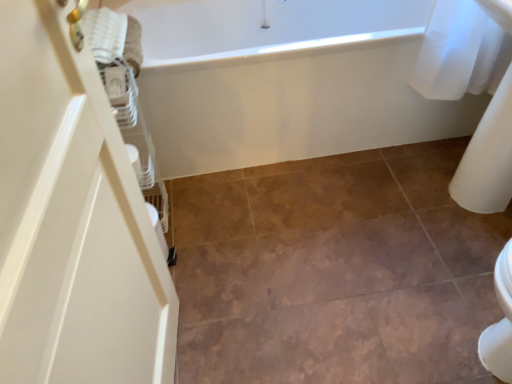
Question: Can you confirm if white glossy bathtub at upper center is positioned to the right of brown matte tile at center?

Choices:
 (A) no
 (B) yes

Answer: (A)

Question: Is the depth of white glossy bathtub at upper center less than that of brown matte tile at center?

Choices:
 (A) yes
 (B) no

Answer: (B)

Question: From a real-world perspective, is white glossy bathtub at upper center on brown matte tile at center?

Choices:
 (A) no
 (B) yes

Answer: (B)

Question: From the image's perspective, is white glossy bathtub at upper center under brown matte tile at center?

Choices:
 (A) no
 (B) yes

Answer: (A)

Question: Is white glossy bathtub at upper center looking in the opposite direction of brown matte tile at center?

Choices:
 (A) yes
 (B) no

Answer: (B)

Question: Considering their positions, is brown matte tile at center located in front of or behind white glossy bathtub at upper center?

Choices:
 (A) behind
 (B) front

Answer: (B)

Question: From the image's perspective, is brown matte tile at center located above or below white glossy bathtub at upper center?

Choices:
 (A) below
 (B) above

Answer: (A)

Question: Based on their sizes in the image, would you say brown matte tile at center is bigger or smaller than white glossy bathtub at upper center?

Choices:
 (A) small
 (B) big

Answer: (A)

Question: Considering the positions of brown matte tile at center and white glossy bathtub at upper center in the image, is brown matte tile at center taller or shorter than white glossy bathtub at upper center?

Choices:
 (A) tall
 (B) short

Answer: (B)

Question: In the image, is brown matte tile at center on the left side or the right side of white textured towel at upper left?

Choices:
 (A) left
 (B) right

Answer: (B)

Question: Would you say brown matte tile at center is inside or outside white textured towel at upper left?

Choices:
 (A) inside
 (B) outside

Answer: (B)

Question: In terms of height, does brown matte tile at center look taller or shorter compared to white textured towel at upper left?

Choices:
 (A) short
 (B) tall

Answer: (A)

Question: Is point (202, 200) closer or farther from the camera than point (119, 41)?

Choices:
 (A) closer
 (B) farther

Answer: (B)

Question: From a real-world perspective, relative to white textured towel at upper left, is white glossy bathtub at upper center vertically above or below?

Choices:
 (A) below
 (B) above

Answer: (A)

Question: Considering the positions of white glossy bathtub at upper center and white textured towel at upper left in the image, is white glossy bathtub at upper center taller or shorter than white textured towel at upper left?

Choices:
 (A) tall
 (B) short

Answer: (A)